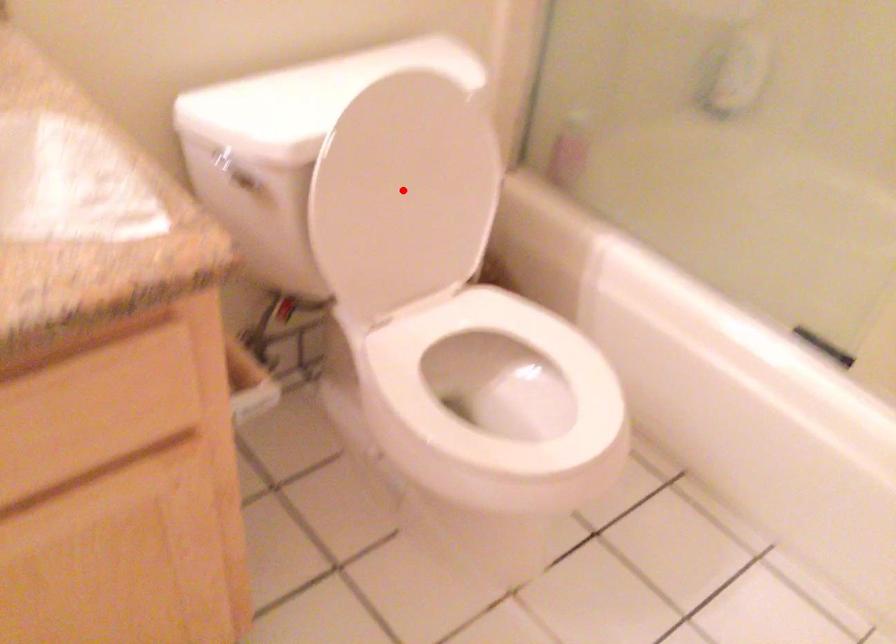
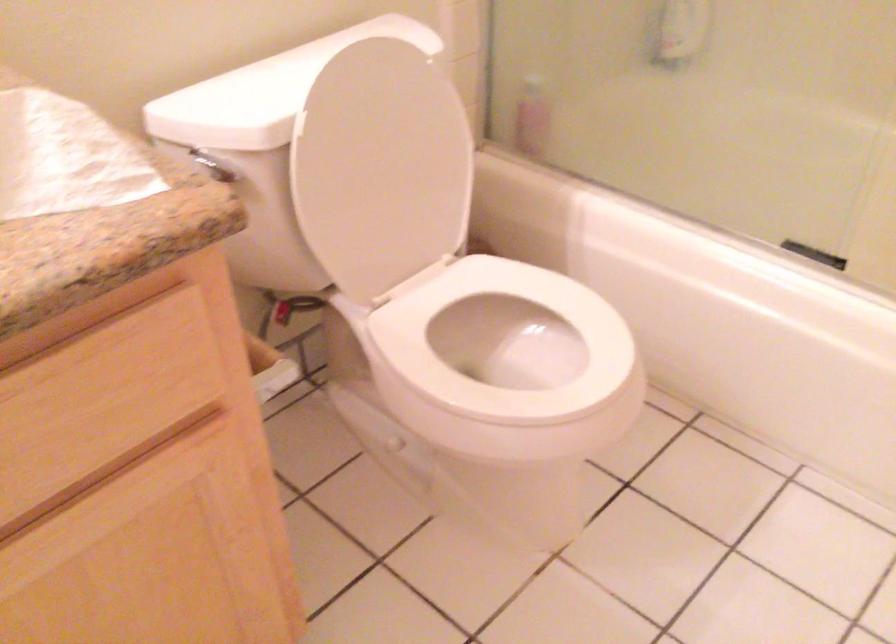
In the second image, find the point that corresponds to the highlighted location in the first image.

(381, 167)